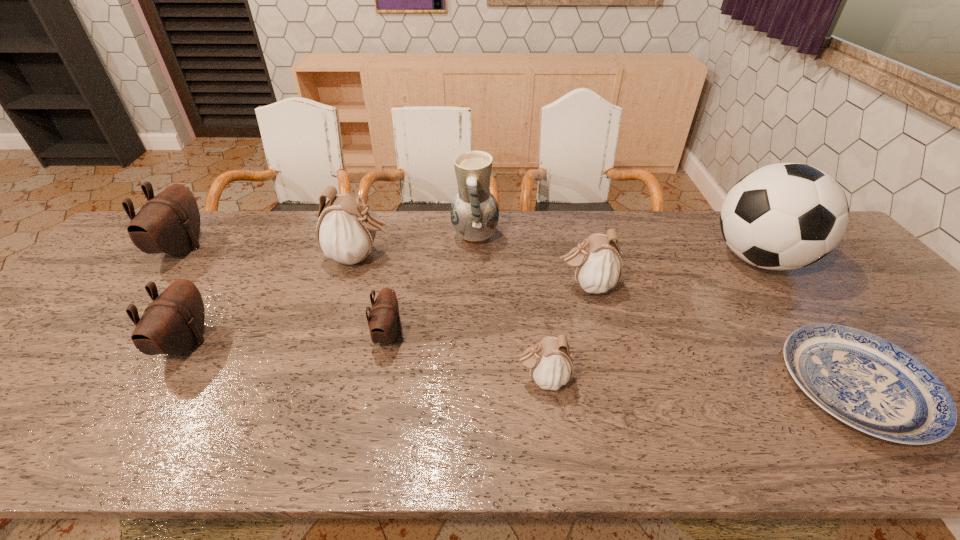
The height and width of the screenshot is (540, 960). Find the location of `vacant space that satisfies the following two spatial constraints: 1. on the front side of the soccer ball; 2. with the flap open on the smallest brown pouch`. vacant space that satisfies the following two spatial constraints: 1. on the front side of the soccer ball; 2. with the flap open on the smallest brown pouch is located at coordinates (817, 335).

Where is `free location that satisfies the following two spatial constraints: 1. on either side of the fifth object from right to left; 2. on the back side of the black soccer ball`? The image size is (960, 540). free location that satisfies the following two spatial constraints: 1. on either side of the fifth object from right to left; 2. on the back side of the black soccer ball is located at coordinates (474, 259).